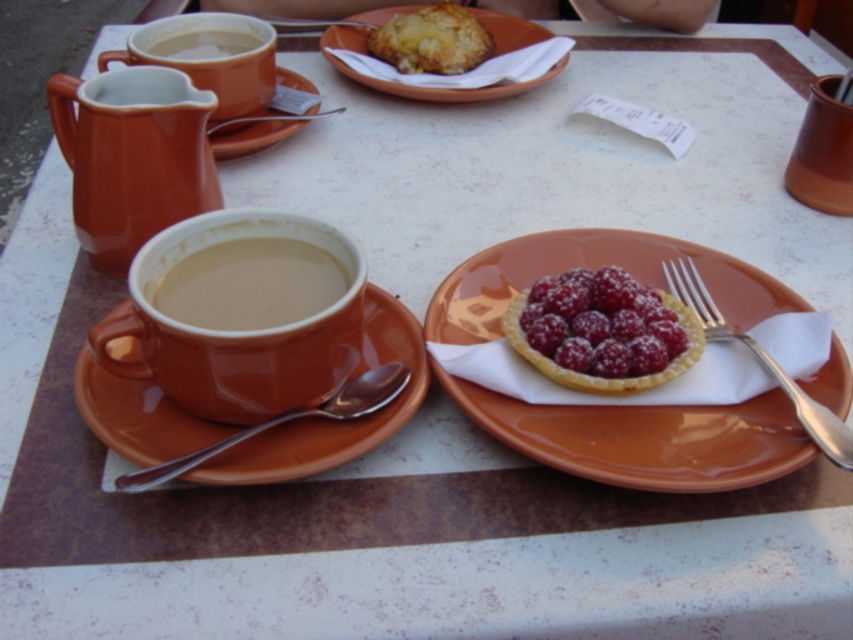
You are a customer at the cafe and want to eat the golden flaky pastry at center. The server tells you that the silver metallic fork at right is the correct utensil for the dessert. Is the fork big enough to handle the pastry?

The golden flaky pastry at center is larger than the silver metallic fork at right, so the fork may not be big enough to handle the pastry effectively.

You are a customer at the cafe and want to grab the silver metallic fork at right to eat the golden flaky pastry at center. Can you reach it without moving your body?

The golden flaky pastry at center is 19.99 inches away from the silver metallic fork at right. Since the distance is over 19 inches, it might be difficult to reach without moving, so you should move closer.

You are a barista preparing a customer order. You have a brown matte cup at center left and a matte ceramic pastry at upper center on the table. Which item is taller when placed side by side?

The matte ceramic pastry at upper center is taller than the brown matte cup at center left.